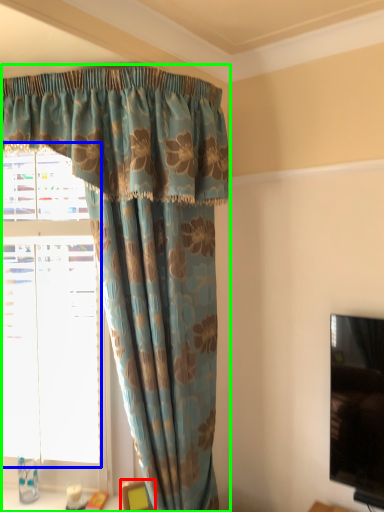
Question: Which object is positioned closest to furniture (highlighted by a red box)? Select from bay window (highlighted by a blue box) and curtain (highlighted by a green box).

Choices:
 (A) bay window
 (B) curtain

Answer: (A)